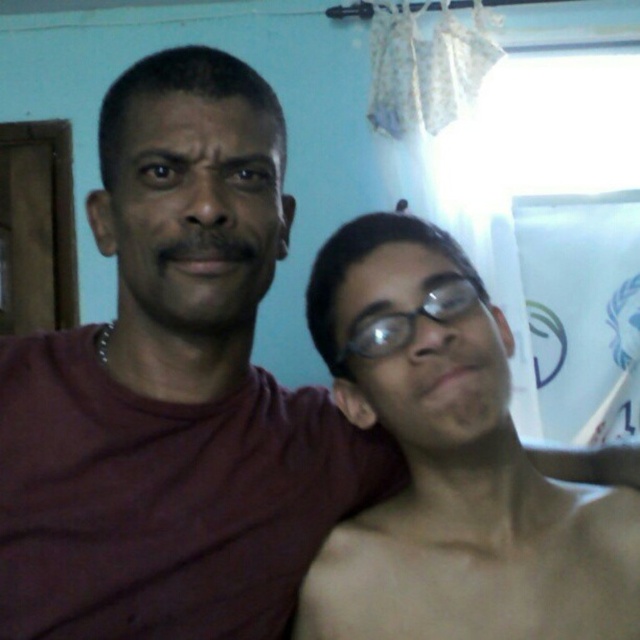
Between shiny black glasses at right and black plastic glasses at center, which one is positioned higher?

black plastic glasses at center is above.

Is point (474, 584) positioned behind point (442, 276)?

Yes, point (474, 584) is behind point (442, 276).

Identify the location of shiny black glasses at right. This screenshot has height=640, width=640. pyautogui.click(x=452, y=464).